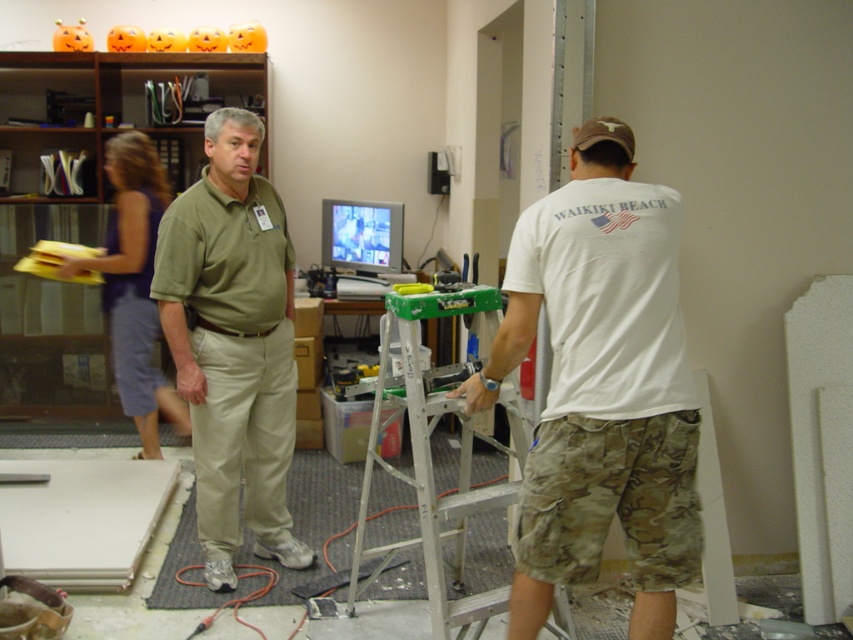
Can you confirm if white cotton t-shirt at center is smaller than silver metallic ladder at center?

Yes.

Is point (572, 371) positioned in front of point (453, 572)?

Yes, point (572, 371) is in front of point (453, 572).

The image size is (853, 640). Find the location of `white cotton t-shirt at center`. white cotton t-shirt at center is located at coordinates (601, 387).

Where is `white cotton t-shirt at center`? The width and height of the screenshot is (853, 640). white cotton t-shirt at center is located at coordinates coord(601,387).

Based on the photo, between white cotton t-shirt at center and blue denim shorts at left, which one has more height?

blue denim shorts at left is taller.

Who is more distant from viewer, (x=616, y=381) or (x=138, y=214)?

Positioned behind is point (x=138, y=214).

Locate an element on the screen. The image size is (853, 640). white cotton t-shirt at center is located at coordinates (601, 387).

Can you confirm if khakimaterial/texture at center is positioned to the right of blue denim shorts at left?

Indeed, khakimaterial/texture at center is positioned on the right side of blue denim shorts at left.

Is khakimaterial/texture at center wider than blue denim shorts at left?

Yes, khakimaterial/texture at center is wider than blue denim shorts at left.

Is point (281, 330) positioned in front of point (151, 356)?

Yes, it is.

This screenshot has height=640, width=853. In order to click on khakimaterial/texture at center in this screenshot , I will do click(233, 344).